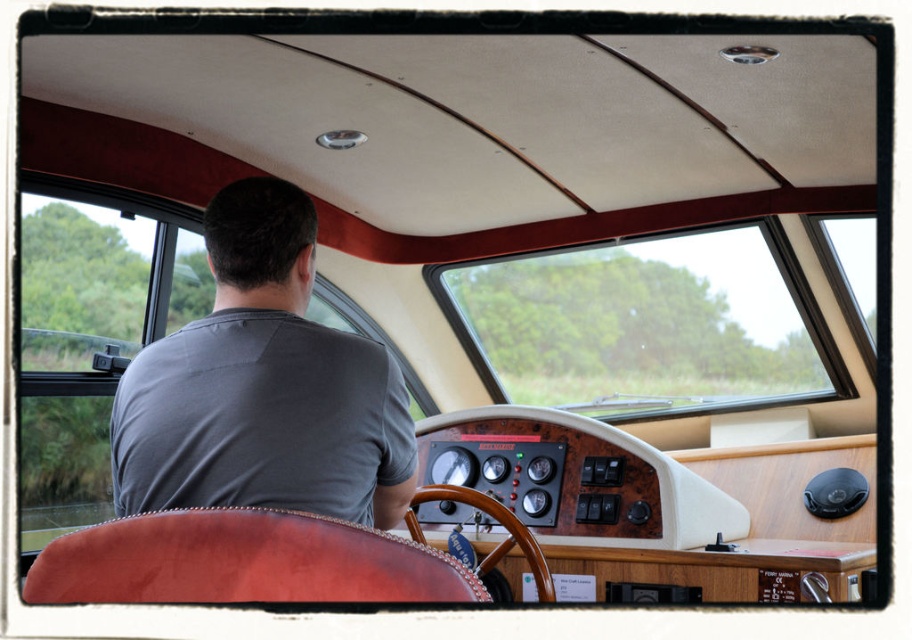
Consider the image. You are a passenger in the boat cabin and want to point out the driver wearing the gray cotton shirt at center and the wooden at center. Which one is located to the left of the other?

The gray cotton shirt at center is positioned on the left side of wooden at center.

You are a passenger in the boat cabin. You notice the gray cotton shirt at center and the wooden at center. Which object is closer to you from your seated position?

The gray cotton shirt at center is closer to you because it is positioned over the wooden at center, indicating it is in a forward or elevated position relative to the wooden object.

In the scene shown: You are a passenger sitting in the boat cabin. You need to place a rectangular object that is 1 meter wide on the dashboard. The dashboard has two sections labeled as gray cotton shirt at center and wooden at center. Which section can accommodate the object based on their widths?

The gray cotton shirt at center has a greater width than the wooden at center. Therefore, the rectangular object that is 1 meter wide can be placed on the gray cotton shirt at center section if its width is sufficient. However, the wooden at center section is narrower and may not fit the object.